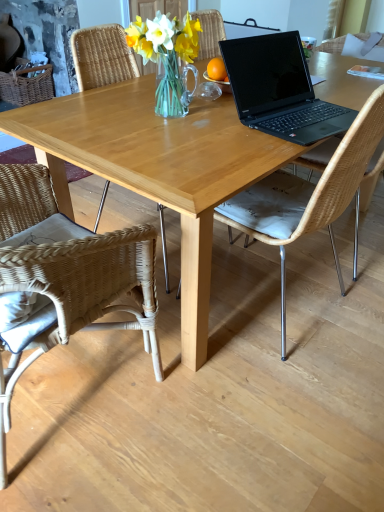
Measure the distance between point [269,144] and camera.

3.96 feet.

This screenshot has width=384, height=512. What do you see at coordinates (279, 89) in the screenshot?
I see `black matte laptop at center` at bounding box center [279, 89].

Find the location of a particular element. clear glass vase at center is located at coordinates (168, 58).

At what (x,y) coordinates should I click in order to perform the action: click on the 2nd chair positioned below the black matte laptop at center (from the image's perspective). Please return your answer as a coordinate pair (x, y). Image resolution: width=384 pixels, height=512 pixels. Looking at the image, I should click on (66, 277).

Based on the photo, considering the positions of objects woven rattan chair at lower left, positioned as the second chair in right-to-left order, and black matte laptop at center in the image provided, who is more to the right, woven rattan chair at lower left, positioned as the second chair in right-to-left order, or black matte laptop at center?

Positioned to the right is black matte laptop at center.

Considering the sizes of objects natural wicker chair at center, which is the 1th chair in right-to-left order, and black matte laptop at center in the image provided, who is thinner, natural wicker chair at center, which is the 1th chair in right-to-left order, or black matte laptop at center?

black matte laptop at center is thinner.

Starting from the black matte laptop at center, which chair is the 1st one to the left? Please provide its 2D coordinates.

[(308, 197)]

Looking at this image, does natural wicker chair at center, the second chair viewed from the left, have a larger size compared to black matte laptop at center?

Correct, natural wicker chair at center, the second chair viewed from the left, is larger in size than black matte laptop at center.

How much distance is there between natural wicker chair at center, the second chair viewed from the left, and black matte laptop at center?

natural wicker chair at center, the second chair viewed from the left, is 11.67 inches away from black matte laptop at center.

Which object is thinner, black matte laptop at center or woven rattan chair at lower left, acting as the first chair starting from the left?

black matte laptop at center is thinner.

From a real-world perspective, relative to woven rattan chair at lower left, positioned as the second chair in right-to-left order, is black matte laptop at center vertically above or below?

From a real-world perspective, black matte laptop at center is physically above woven rattan chair at lower left, positioned as the second chair in right-to-left order.

Does black matte laptop at center come in front of woven rattan chair at lower left, acting as the first chair starting from the left?

No, it is not.

Is black matte laptop at center at the right side of woven rattan chair at lower left, acting as the first chair starting from the left?

Indeed, black matte laptop at center is positioned on the right side of woven rattan chair at lower left, acting as the first chair starting from the left.

Which is more to the left, light wood table at center or natural wicker chair at center, the second chair viewed from the left?

light wood table at center.

Is point (129, 140) positioned in front of point (316, 190)?

No, it is behind (316, 190).

From the image's perspective, who appears lower, light wood table at center or natural wicker chair at center, which is the 1th chair in right-to-left order?

From the image's view, natural wicker chair at center, which is the 1th chair in right-to-left order, is below.

Between point (285, 231) and point (183, 160), which one is positioned in front?

Positioned in front is point (183, 160).

Are natural wicker chair at center, the second chair viewed from the left, and light wood table at center located far from each other?

No.

The width and height of the screenshot is (384, 512). In order to click on chair that is the 2nd one above the light wood table at center (from a real-world perspective) in this screenshot , I will do `click(308, 197)`.

How distant is natural wicker chair at center, the second chair viewed from the left, from light wood table at center?

natural wicker chair at center, the second chair viewed from the left, and light wood table at center are 12.64 inches apart from each other.

Between point (104, 150) and point (181, 46), which one is positioned in front?

The point (104, 150) is closer.

Which is correct: light wood table at center is inside clear glass vase at center, or outside of it?

light wood table at center is outside clear glass vase at center.

Which is more to the left, light wood table at center or clear glass vase at center?

Positioned to the left is clear glass vase at center.

Could you tell me if light wood table at center is turned towards clear glass vase at center?

No, light wood table at center is not turned towards clear glass vase at center.

Are clear glass vase at center and woven rattan chair at lower left, acting as the first chair starting from the left, located far from each other?

Actually, clear glass vase at center and woven rattan chair at lower left, acting as the first chair starting from the left, are a little close together.

From the image's perspective, between clear glass vase at center and woven rattan chair at lower left, positioned as the second chair in right-to-left order, who is located below?

woven rattan chair at lower left, positioned as the second chair in right-to-left order, appears lower in the image.

From a real-world perspective, is clear glass vase at center physically located above or below woven rattan chair at lower left, positioned as the second chair in right-to-left order?

In terms of real-world spatial position, clear glass vase at center is above woven rattan chair at lower left, positioned as the second chair in right-to-left order.

Is point (188, 99) farther from camera compared to point (45, 262)?

Yes, it is behind point (45, 262).

Find the location of a particular element. laptop behind the woven rattan chair at lower left, positioned as the second chair in right-to-left order is located at coordinates (279, 89).

Image resolution: width=384 pixels, height=512 pixels. There is a natural wicker chair at center, which is the 1th chair in right-to-left order. What are the coordinates of `laptop above it (from a real-world perspective)` in the screenshot? It's located at (279, 89).

Looking at this image, which object lies nearer to the anchor point black matte laptop at center, woven rattan chair at lower left, positioned as the second chair in right-to-left order, or clear glass vase at center?

clear glass vase at center is closer to black matte laptop at center.

Based on their spatial positions, is clear glass vase at center or light wood table at center further from natural wicker chair at center, the second chair viewed from the left?

clear glass vase at center lies further to natural wicker chair at center, the second chair viewed from the left, than the other object.

Estimate the real-world distances between objects in this image. Which object is closer to black matte laptop at center, woven rattan chair at lower left, positioned as the second chair in right-to-left order, or natural wicker chair at center, which is the 1th chair in right-to-left order?

natural wicker chair at center, which is the 1th chair in right-to-left order, lies closer to black matte laptop at center than the other object.

Estimate the real-world distances between objects in this image. Which object is further from woven rattan chair at lower left, positioned as the second chair in right-to-left order, black matte laptop at center or natural wicker chair at center, which is the 1th chair in right-to-left order?

black matte laptop at center is positioned further to the anchor woven rattan chair at lower left, positioned as the second chair in right-to-left order.

From the picture: From the image, which object appears to be nearer to woven rattan chair at lower left, acting as the first chair starting from the left, natural wicker chair at center, which is the 1th chair in right-to-left order, or black matte laptop at center?

natural wicker chair at center, which is the 1th chair in right-to-left order, lies closer to woven rattan chair at lower left, acting as the first chair starting from the left, than the other object.

From the image, which object appears to be nearer to black matte laptop at center, natural wicker chair at center, the second chair viewed from the left, or clear glass vase at center?

The object closer to black matte laptop at center is natural wicker chair at center, the second chair viewed from the left.

Estimate the real-world distances between objects in this image. Which object is closer to clear glass vase at center, natural wicker chair at center, which is the 1th chair in right-to-left order, or woven rattan chair at lower left, acting as the first chair starting from the left?

natural wicker chair at center, which is the 1th chair in right-to-left order, is closer to clear glass vase at center.

Based on their spatial positions, is woven rattan chair at lower left, acting as the first chair starting from the left, or black matte laptop at center closer to natural wicker chair at center, which is the 1th chair in right-to-left order?

The object closer to natural wicker chair at center, which is the 1th chair in right-to-left order, is black matte laptop at center.

I want to click on chair situated between woven rattan chair at lower left, positioned as the second chair in right-to-left order, and black matte laptop at center from left to right, so click(x=308, y=197).

You are a GUI agent. You are given a task and a screenshot of the screen. Output one action in this format:
    pyautogui.click(x=<x>, y=<y>)
    Task: Click on the desk between clear glass vase at center and woven rattan chair at lower left, acting as the first chair starting from the left, vertically
    
    Given the screenshot: What is the action you would take?
    pyautogui.click(x=157, y=168)

The width and height of the screenshot is (384, 512). In order to click on desk situated between clear glass vase at center and black matte laptop at center from left to right in this screenshot , I will do `click(157, 168)`.

Find the location of `floral arrangement situated between woven rattan chair at lower left, acting as the first chair starting from the left, and black matte laptop at center from left to right`. floral arrangement situated between woven rattan chair at lower left, acting as the first chair starting from the left, and black matte laptop at center from left to right is located at coordinates (168, 58).